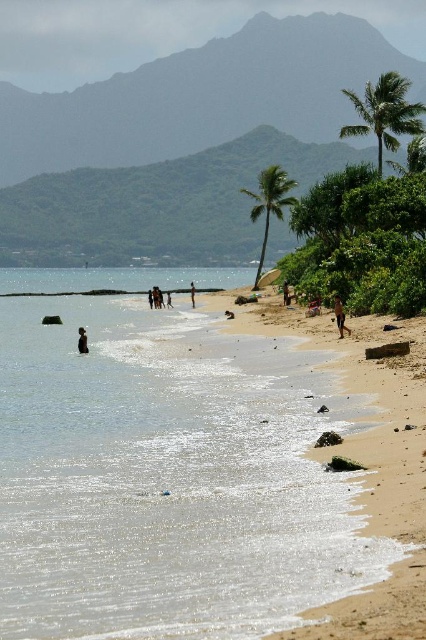
You are a beachgoer who wants to take a photo of the clear water at beach left and dark brown skin at lower left. Which object is taller in the scene?

The clear water at beach left is much taller than the dark brown skin at lower left.

You are a photographer on the beach and want to capture a photo that includes both the dark brown skin at lower left and dark brown skin at center. Which of the two subjects should you focus on first if you want to ensure both are in the frame without moving the camera?

The dark brown skin at lower left is below the dark brown skin at center, so you should focus on the dark brown skin at center first to ensure both are in the frame without moving the camera.

You are standing on the beach and want to walk to both the point at coordinates (x=78, y=346) and the point at coordinates (x=169, y=300). Which point will you reach first if you start walking towards them from your current position?

You will reach the point at coordinates (x=78, y=346) first because it is closer to you than the point at coordinates (x=169, y=300).